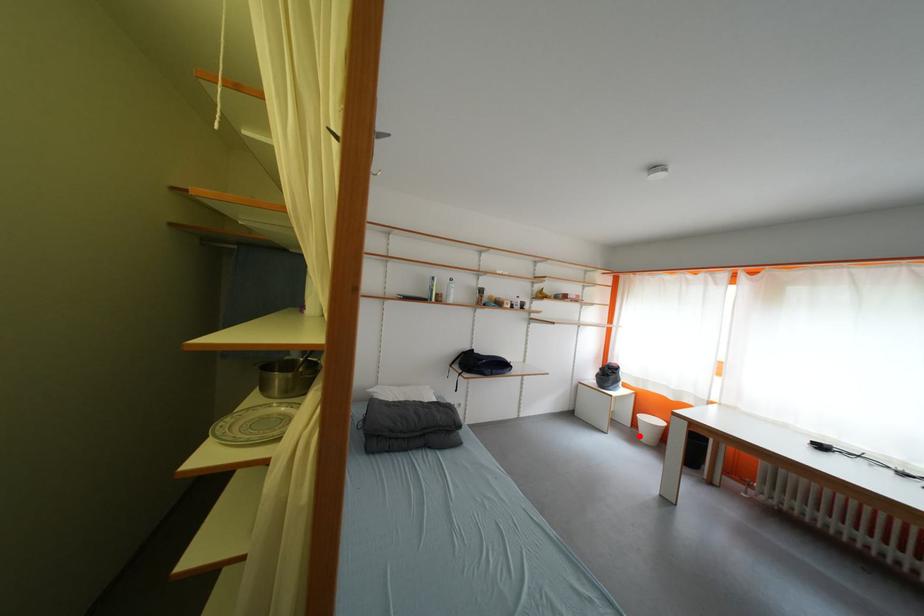
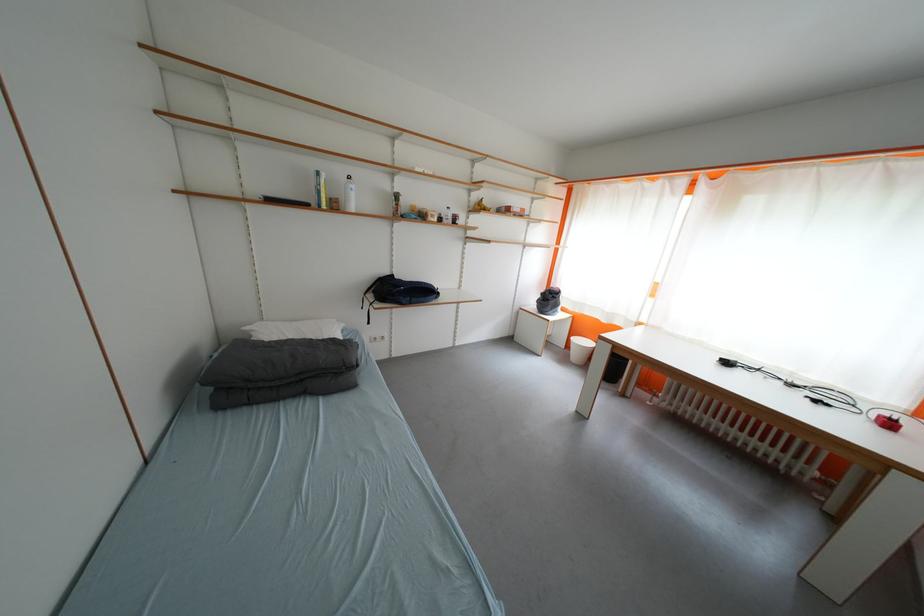
In the second image, find the point that corresponds to the highlighted location in the first image.

(572, 358)